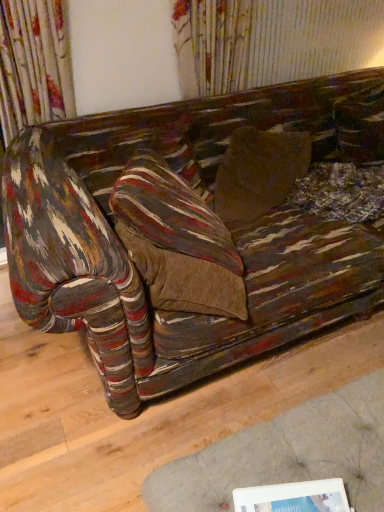
Question: Relative to white plastic picture frame at lower right, is textured multicolored fabric couch at center in front or behind?

Choices:
 (A) behind
 (B) front

Answer: (A)

Question: In terms of width, does textured multicolored fabric couch at center look wider or thinner when compared to white plastic picture frame at lower right?

Choices:
 (A) thin
 (B) wide

Answer: (B)

Question: From the image's perspective, is textured multicolored fabric couch at center positioned above or below white plastic picture frame at lower right?

Choices:
 (A) below
 (B) above

Answer: (B)

Question: Is white plastic picture frame at lower right to the left or to the right of textured multicolored fabric couch at center in the image?

Choices:
 (A) right
 (B) left

Answer: (B)

Question: From a real-world perspective, is white plastic picture frame at lower right physically located above or below textured multicolored fabric couch at center?

Choices:
 (A) below
 (B) above

Answer: (B)

Question: Considering the positions of white plastic picture frame at lower right and textured multicolored fabric couch at center in the image, is white plastic picture frame at lower right bigger or smaller than textured multicolored fabric couch at center?

Choices:
 (A) big
 (B) small

Answer: (B)

Question: In terms of height, does white plastic picture frame at lower right look taller or shorter compared to textured multicolored fabric couch at center?

Choices:
 (A) short
 (B) tall

Answer: (B)